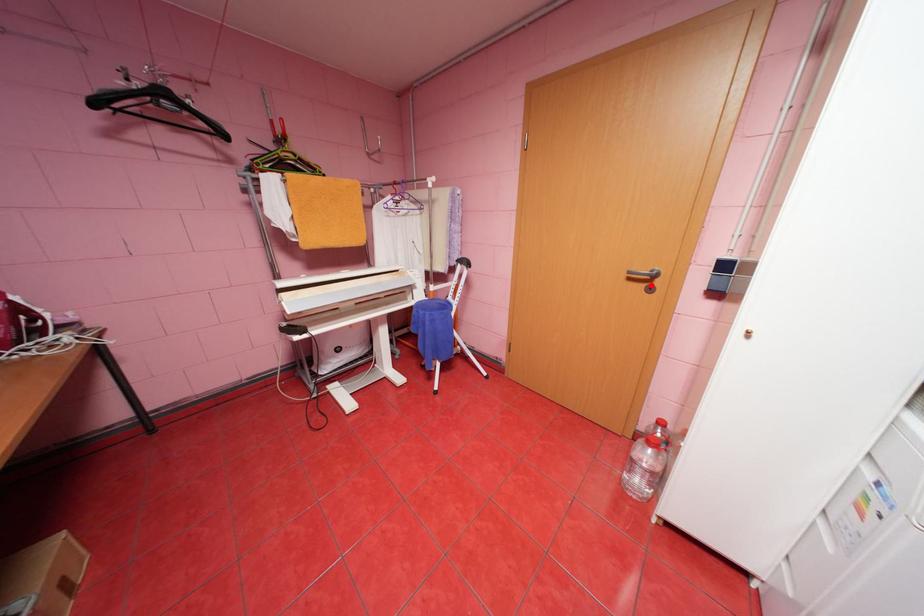
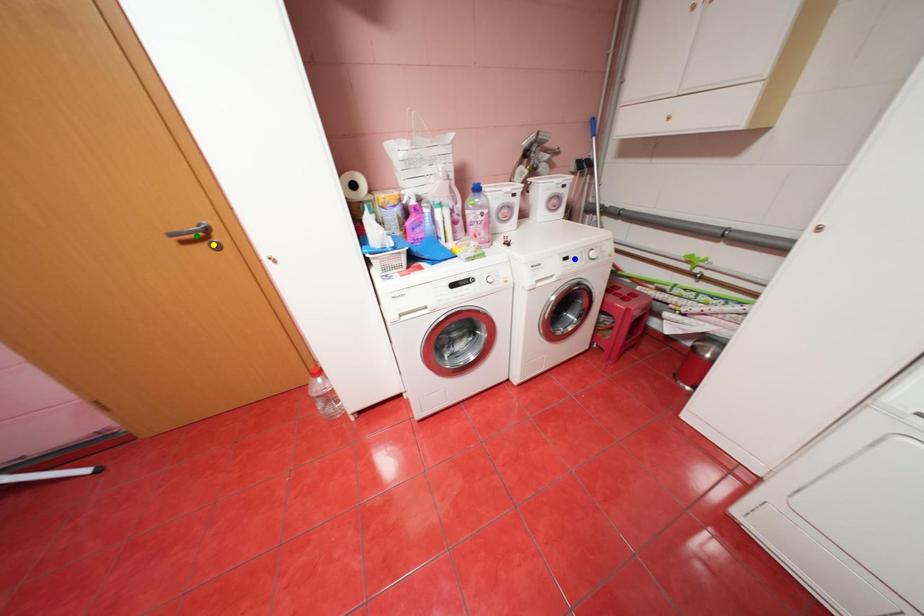
Question: I am providing you with two images of the same scene from different viewpoints. A red point is marked on the first image. You are given multiple points on the second image. Can you choose the point in image 2 that corresponds to the point in image 1?

Choices:
 (A) blue point
 (B) yellow point
 (C) green point

Answer: (B)